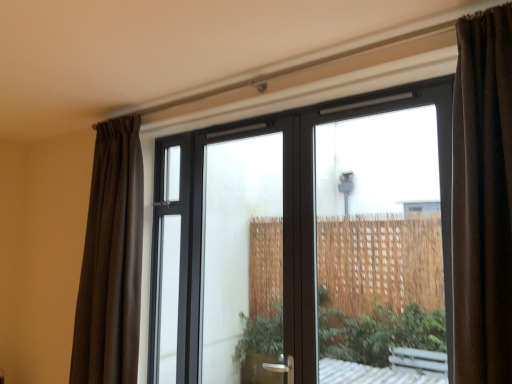
Question: Considering the relative sizes of transparent glass door at center and brown sheer curtain at left in the image provided, is transparent glass door at center smaller than brown sheer curtain at left?

Choices:
 (A) no
 (B) yes

Answer: (A)

Question: Is transparent glass door at center next to brown sheer curtain at left and touching it?

Choices:
 (A) yes
 (B) no

Answer: (B)

Question: Does transparent glass door at center have a greater width compared to brown sheer curtain at left?

Choices:
 (A) no
 (B) yes

Answer: (A)

Question: Would you consider transparent glass door at center to be distant from brown sheer curtain at left?

Choices:
 (A) yes
 (B) no

Answer: (B)

Question: Does transparent glass door at center appear on the left side of brown sheer curtain at left?

Choices:
 (A) no
 (B) yes

Answer: (A)

Question: Is brown sheer curtain at left situated inside transparent glass door at center or outside?

Choices:
 (A) outside
 (B) inside

Answer: (A)

Question: Considering the relative positions of brown sheer curtain at left and transparent glass door at center in the image provided, is brown sheer curtain at left to the left or to the right of transparent glass door at center?

Choices:
 (A) left
 (B) right

Answer: (A)

Question: In terms of width, does brown sheer curtain at left look wider or thinner when compared to transparent glass door at center?

Choices:
 (A) wide
 (B) thin

Answer: (A)

Question: In terms of size, does brown sheer curtain at left appear bigger or smaller than transparent glass door at center?

Choices:
 (A) big
 (B) small

Answer: (B)

Question: From the image's perspective, is transparent glass door at center above or below transparent glass window at center?

Choices:
 (A) above
 (B) below

Answer: (B)

Question: Looking at their shapes, would you say transparent glass door at center is wider or thinner than transparent glass window at center?

Choices:
 (A) thin
 (B) wide

Answer: (A)

Question: Is transparent glass door at center spatially inside transparent glass window at center, or outside of it?

Choices:
 (A) outside
 (B) inside

Answer: (B)

Question: Based on their positions, is transparent glass door at center located to the left or right of transparent glass window at center?

Choices:
 (A) right
 (B) left

Answer: (B)

Question: In the image, is transparent glass window at center on the left side or the right side of transparent glass door at center?

Choices:
 (A) right
 (B) left

Answer: (A)

Question: Does point (238, 311) appear closer or farther from the camera than point (267, 203)?

Choices:
 (A) farther
 (B) closer

Answer: (B)